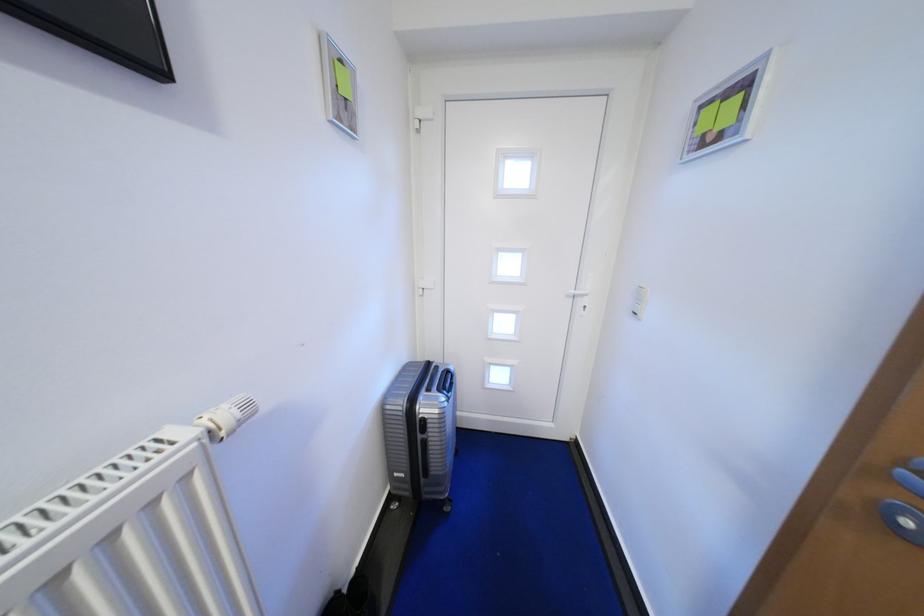
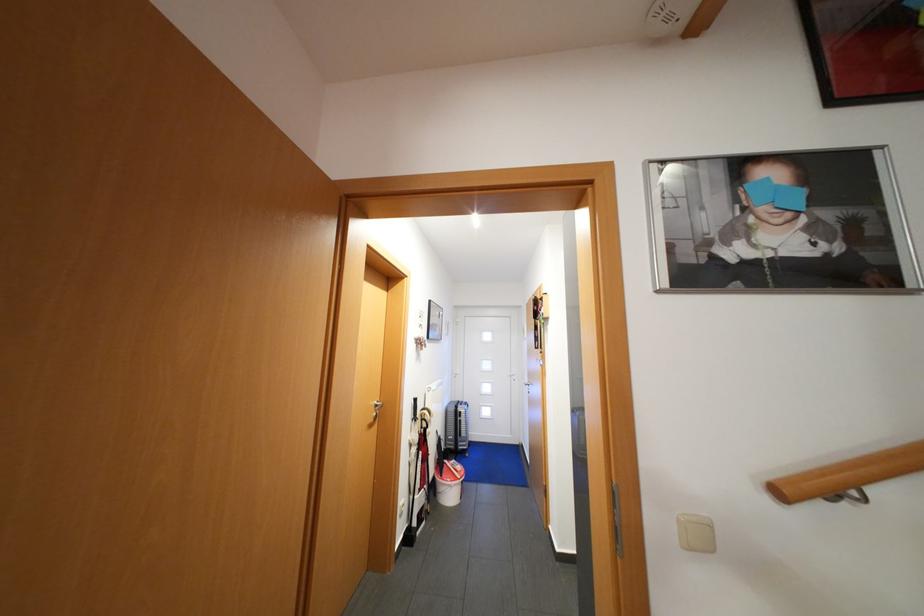
Question: Which direction would the cameraman need to move to produce the second image? Reply with the corresponding letter.

Choices:
 (A) Left
 (B) Right
 (C) Forward
 (D) Backward

Answer: (D)